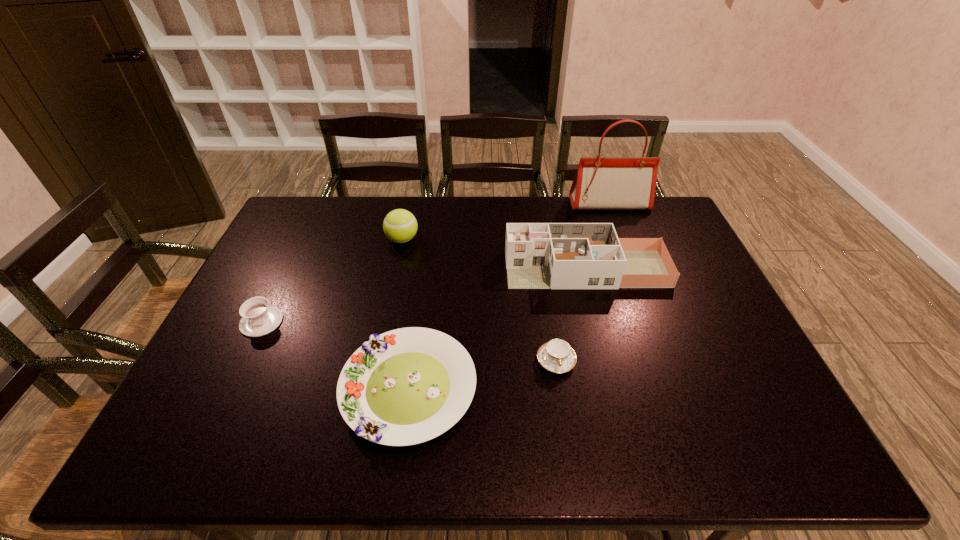
Where is `vacant space that is in between the nearer teacup and the tennis ball`? The image size is (960, 540). vacant space that is in between the nearer teacup and the tennis ball is located at coordinates (479, 300).

Identify the location of free area in between the tallest object and the tennis ball. (506, 222).

Locate an element on the screen. The width and height of the screenshot is (960, 540). vacant area that lies between the nearer teacup and the third farthest object is located at coordinates (571, 315).

Locate an element on the screen. empty space between the nearer teacup and the second farthest object is located at coordinates (479, 300).

This screenshot has width=960, height=540. What are the coordinates of `unoccupied position between the tallest object and the salad plate` in the screenshot? It's located at (509, 296).

The image size is (960, 540). In order to click on free spot between the nearer teacup and the salad plate in this screenshot , I will do `click(483, 375)`.

Identify which object is the third closest to the second farthest object. Please provide its 2D coordinates. Your answer should be formatted as a tuple, i.e. [(x, y)], where the tuple contains the x and y coordinates of a point satisfying the conditions above.

[(406, 386)]

Select which object appears as the fourth closest to the leftmost object. Please provide its 2D coordinates. Your answer should be formatted as a tuple, i.e. [(x, y)], where the tuple contains the x and y coordinates of a point satisfying the conditions above.

[(557, 356)]

Identify the location of free location that satisfies the following two spatial constraints: 1. at the entrance of the dollhouse; 2. on the side with the handle of the right teacup. (610, 361).

Locate an element on the screen. free location that satisfies the following two spatial constraints: 1. at the entrance of the dollhouse; 2. on the side with the handle of the nearer teacup is located at coordinates (610, 361).